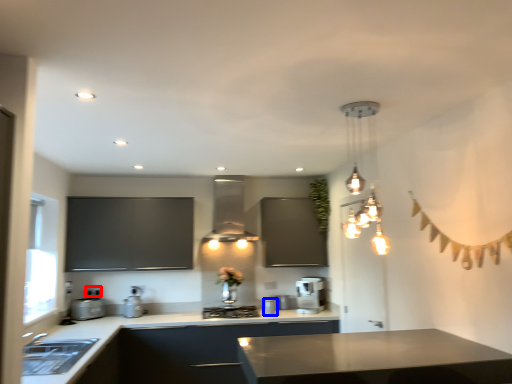
Question: Which point is closer to the camera, electric outlet (highlighted by a red box) or appliance (highlighted by a blue box)?

Choices:
 (A) electric outlet
 (B) appliance

Answer: (B)